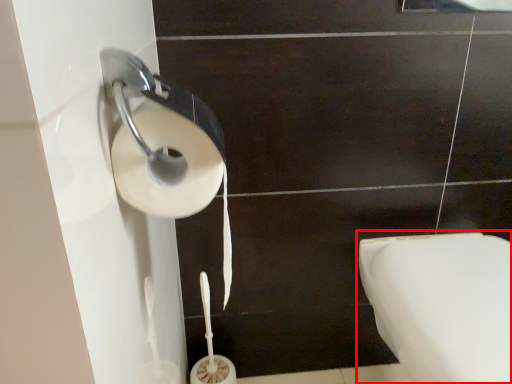
Question: From the image, what is the correct spatial relationship of toilet (annotated by the red box) in relation to toilet paper?

Choices:
 (A) right
 (B) left

Answer: (A)